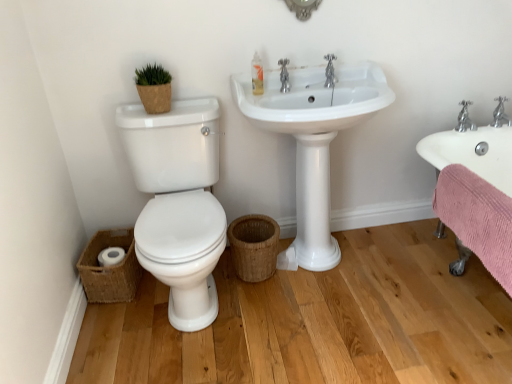
Measure the distance between white glossy sink at center, the first sink positioned from the left, and camera.

They are 1.62 meters apart.

What do you see at coordinates (313, 140) in the screenshot?
I see `white glossy sink at center, placed as the second sink when sorted from right to left` at bounding box center [313, 140].

This screenshot has height=384, width=512. Describe the element at coordinates (110, 268) in the screenshot. I see `woven brown basket at lower left, which is counted as the 2th basket, starting from the right` at that location.

This screenshot has height=384, width=512. Identify the location of pink textured towel at right, which is the second sink in left-to-right order. (475, 193).

This screenshot has width=512, height=384. I want to click on woven brown basket at lower center, the 1th basket when ordered from right to left, so click(x=254, y=246).

Is point (245, 254) positioned in front of point (211, 170)?

That is True.

Considering the relative sizes of woven brown basket at lower center, which appears as the 2th basket when viewed from the left, and white glossy toilet at left in the image provided, is woven brown basket at lower center, which appears as the 2th basket when viewed from the left, bigger than white glossy toilet at left?

Actually, woven brown basket at lower center, which appears as the 2th basket when viewed from the left, might be smaller than white glossy toilet at left.

How many degrees apart are the facing directions of woven brown basket at lower center, the 1th basket when ordered from right to left, and white glossy toilet at left?

3.5 degrees.

Considering the positions of objects woven brown basket at lower center, the 1th basket when ordered from right to left, and white glossy toilet at left in the image provided, who is behind, woven brown basket at lower center, the 1th basket when ordered from right to left, or white glossy toilet at left?

woven brown basket at lower center, the 1th basket when ordered from right to left.

Who is bigger, chrome metallic faucet at upper right, the 1th tap from the right, or chrome metallic faucet at upper center, which ranks as the 1th tap in top-to-bottom order?

Bigger between the two is chrome metallic faucet at upper right, the 1th tap from the right.

Who is taller, chrome metallic faucet at upper right, the 1th tap from the right, or chrome metallic faucet at upper center, placed as the 2th tap when sorted from right to left?

With more height is chrome metallic faucet at upper center, placed as the 2th tap when sorted from right to left.

Looking at this image, does chrome metallic faucet at upper right, which is the second tap from left to right, turn towards chrome metallic faucet at upper center, which ranks as the 1th tap in top-to-bottom order?

No, chrome metallic faucet at upper right, which is the second tap from left to right, is not turned towards chrome metallic faucet at upper center, which ranks as the 1th tap in top-to-bottom order.

Considering the sizes of woven brown basket at lower center, which appears as the 2th basket when viewed from the left, and chrome metallic faucet at upper right, which is the second tap from left to right, in the image, is woven brown basket at lower center, which appears as the 2th basket when viewed from the left, wider or thinner than chrome metallic faucet at upper right, which is the second tap from left to right,?

woven brown basket at lower center, which appears as the 2th basket when viewed from the left, is wider than chrome metallic faucet at upper right, which is the second tap from left to right.

Is chrome metallic faucet at upper right, the 1th tap in the bottom-to-top sequence, located within woven brown basket at lower center, which appears as the 2th basket when viewed from the left?

No, chrome metallic faucet at upper right, the 1th tap in the bottom-to-top sequence, is located outside of woven brown basket at lower center, which appears as the 2th basket when viewed from the left.

From the image's perspective, count 1st taps upward from the woven brown basket at lower center, which appears as the 2th basket when viewed from the left, and point to it. Please provide its 2D coordinates.

[(500, 114)]

Is white glossy toilet at left located outside translucent plastic soap dispenser at upper center?

white glossy toilet at left is positioned outside translucent plastic soap dispenser at upper center.

In terms of size, does white glossy toilet at left appear bigger or smaller than translucent plastic soap dispenser at upper center?

Considering their sizes, white glossy toilet at left takes up more space than translucent plastic soap dispenser at upper center.

Which is behind, point (218, 201) or point (262, 79)?

The point (218, 201) is more distant.

Considering the positions of objects translucent plastic soap dispenser at upper center and woven brown basket at lower center, which appears as the 2th basket when viewed from the left, in the image provided, who is behind, translucent plastic soap dispenser at upper center or woven brown basket at lower center, which appears as the 2th basket when viewed from the left,?

woven brown basket at lower center, which appears as the 2th basket when viewed from the left, is further from the camera.

Which object is positioned more to the left, translucent plastic soap dispenser at upper center or woven brown basket at lower center, which appears as the 2th basket when viewed from the left?

Positioned to the left is woven brown basket at lower center, which appears as the 2th basket when viewed from the left.

Considering the relative sizes of translucent plastic soap dispenser at upper center and woven brown basket at lower center, the 1th basket when ordered from right to left, in the image provided, is translucent plastic soap dispenser at upper center taller than woven brown basket at lower center, the 1th basket when ordered from right to left,?

Incorrect, the height of translucent plastic soap dispenser at upper center is not larger of that of woven brown basket at lower center, the 1th basket when ordered from right to left.

Does point (254, 53) come behind point (250, 234)?

That is False.

Is woven brown basket at lower center, the 1th basket when ordered from right to left, inside or outside of pink textured towel at right, which is the second sink in left-to-right order?

woven brown basket at lower center, the 1th basket when ordered from right to left, is located beyond the bounds of pink textured towel at right, which is the second sink in left-to-right order.

Locate an element on the screen. This screenshot has height=384, width=512. the 1st basket positioned below the pink textured towel at right, the first sink in the right-to-left sequence (from the image's perspective) is located at coordinates (254, 246).

Is woven brown basket at lower center, which appears as the 2th basket when viewed from the left, thinner than pink textured towel at right, which is the second sink in left-to-right order?

No.

From the picture: From the image's perspective, is translucent plastic soap dispenser at upper center positioned above or below chrome metallic faucet at upper right, which ranks as the second tap in top-to-bottom order?

translucent plastic soap dispenser at upper center is above chrome metallic faucet at upper right, which ranks as the second tap in top-to-bottom order.

Are translucent plastic soap dispenser at upper center and chrome metallic faucet at upper right, which is the second tap from left to right, making contact?

No, translucent plastic soap dispenser at upper center is not beside chrome metallic faucet at upper right, which is the second tap from left to right.

Is translucent plastic soap dispenser at upper center facing towards chrome metallic faucet at upper right, which is the second tap from left to right?

No, translucent plastic soap dispenser at upper center is not aimed at chrome metallic faucet at upper right, which is the second tap from left to right.

Is translucent plastic soap dispenser at upper center wider than chrome metallic faucet at upper right, which ranks as the second tap in top-to-bottom order?

Incorrect, the width of translucent plastic soap dispenser at upper center does not surpass that of chrome metallic faucet at upper right, which ranks as the second tap in top-to-bottom order.

I want to click on toilet in front of the woven brown basket at lower center, which appears as the 2th basket when viewed from the left, so click(x=178, y=203).

Where is `tap on the left of chrome metallic faucet at upper right, the 1th tap from the right`? tap on the left of chrome metallic faucet at upper right, the 1th tap from the right is located at coordinates (330, 72).

From the image, which object appears to be nearer to white glossy sink at center, the first sink positioned from the left, translucent plastic soap dispenser at upper center or woven brown basket at lower left, which is counted as the 2th basket, starting from the right?

Based on the image, translucent plastic soap dispenser at upper center appears to be nearer to white glossy sink at center, the first sink positioned from the left.

When comparing their distances from woven brown basket at lower center, which appears as the 2th basket when viewed from the left, does woven brown basket at lower left, arranged as the 1th basket when viewed from the left, or white glossy toilet at left seem further?

woven brown basket at lower left, arranged as the 1th basket when viewed from the left, is further to woven brown basket at lower center, which appears as the 2th basket when viewed from the left.

Based on their spatial positions, is woven brown basket at lower left, which is counted as the 2th basket, starting from the right, or woven brown basket at lower center, which appears as the 2th basket when viewed from the left, closer to chrome metallic faucet at upper right, the 1th tap in the bottom-to-top sequence?

Based on the image, woven brown basket at lower center, which appears as the 2th basket when viewed from the left, appears to be nearer to chrome metallic faucet at upper right, the 1th tap in the bottom-to-top sequence.

Estimate the real-world distances between objects in this image. Which object is further from woven brown basket at lower left, which is counted as the 2th basket, starting from the right, chrome metallic faucet at upper right, which is the second tap from left to right, or pink textured towel at right, the first sink in the right-to-left sequence?

The object further to woven brown basket at lower left, which is counted as the 2th basket, starting from the right, is chrome metallic faucet at upper right, which is the second tap from left to right.

In the scene shown: Looking at the image, which one is located closer to woven brown basket at lower center, the 1th basket when ordered from right to left, chrome metallic faucet at upper center, which is the 2th tap from bottom to top, or woven brown basket at lower left, which is counted as the 2th basket, starting from the right?

Based on the image, woven brown basket at lower left, which is counted as the 2th basket, starting from the right, appears to be nearer to woven brown basket at lower center, the 1th basket when ordered from right to left.

Estimate the real-world distances between objects in this image. Which object is closer to white glossy sink at center, placed as the second sink when sorted from right to left, woven brown basket at lower left, which is counted as the 2th basket, starting from the right, or pink textured towel at right, which is the second sink in left-to-right order?

Among the two, pink textured towel at right, which is the second sink in left-to-right order, is located nearer to white glossy sink at center, placed as the second sink when sorted from right to left.

Which object lies further to the anchor point woven brown basket at lower left, which is counted as the 2th basket, starting from the right, translucent plastic soap dispenser at upper center or pink textured towel at right, the first sink in the right-to-left sequence?

Based on the image, pink textured towel at right, the first sink in the right-to-left sequence, appears to be further to woven brown basket at lower left, which is counted as the 2th basket, starting from the right.

From the picture: Estimate the real-world distances between objects in this image. Which object is closer to white glossy toilet at left, woven brown basket at lower left, arranged as the 1th basket when viewed from the left, or pink textured towel at right, which is the second sink in left-to-right order?

Among the two, woven brown basket at lower left, arranged as the 1th basket when viewed from the left, is located nearer to white glossy toilet at left.

At what (x,y) coordinates should I click in order to perform the action: click on sink situated between white glossy toilet at left and chrome metallic faucet at upper center, which ranks as the 1th tap in top-to-bottom order, from left to right. Please return your answer as a coordinate pair (x, y). The height and width of the screenshot is (384, 512). Looking at the image, I should click on [313, 140].

The image size is (512, 384). I want to click on toiletry between woven brown basket at lower left, arranged as the 1th basket when viewed from the left, and chrome metallic faucet at upper center, which is the 2th tap from bottom to top, from left to right, so click(257, 75).

Where is `toilet between woven brown basket at lower left, which is counted as the 2th basket, starting from the right, and chrome metallic faucet at upper right, the 1th tap from the right, from left to right`? The image size is (512, 384). toilet between woven brown basket at lower left, which is counted as the 2th basket, starting from the right, and chrome metallic faucet at upper right, the 1th tap from the right, from left to right is located at coordinates (178, 203).

In order to click on tap located between translucent plastic soap dispenser at upper center and pink textured towel at right, which is the second sink in left-to-right order, in the left-right direction in this screenshot , I will do `click(330, 72)`.